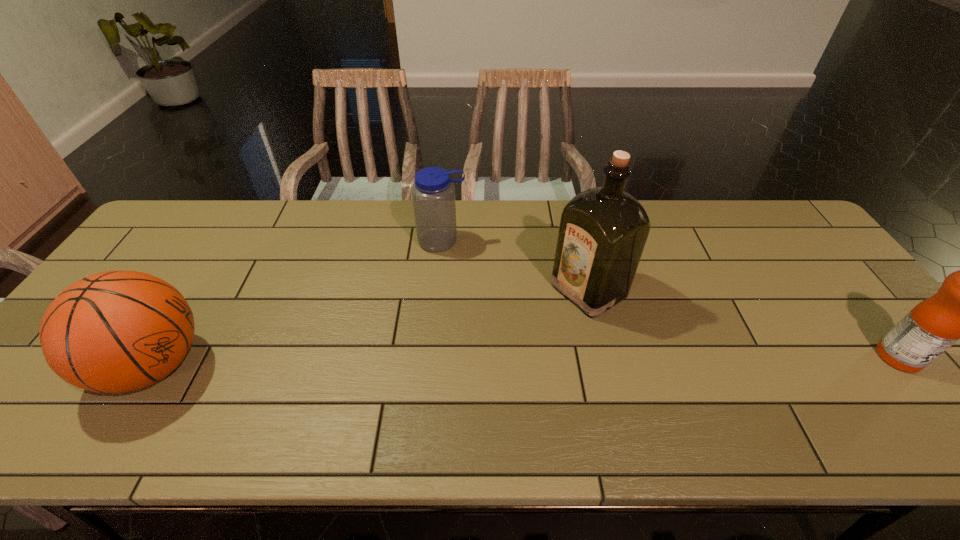
The image size is (960, 540). In the image, there is a desktop. What are the coordinates of `vacant space at the far edge` in the screenshot? It's located at (544, 208).

You are a GUI agent. You are given a task and a screenshot of the screen. Output one action in this format:
    pyautogui.click(x=<x>, y=<y>)
    Task: Click on the free space at the near edge of the desktop
    
    Given the screenshot: What is the action you would take?
    pyautogui.click(x=391, y=378)

At what (x,y) coordinates should I click in order to perform the action: click on vacant area at the right edge of the desktop. Please return your answer as a coordinate pair (x, y). The height and width of the screenshot is (540, 960). Looking at the image, I should click on (780, 249).

You are a GUI agent. You are given a task and a screenshot of the screen. Output one action in this format:
    pyautogui.click(x=<x>, y=<y>)
    Task: Click on the vacant position at the far left corner of the desktop
    This screenshot has height=540, width=960.
    Given the screenshot: What is the action you would take?
    pyautogui.click(x=197, y=228)

In the image, there is a desktop. Where is `vacant space at the near right corner`? vacant space at the near right corner is located at coordinates pyautogui.click(x=920, y=401).

You are a GUI agent. You are given a task and a screenshot of the screen. Output one action in this format:
    pyautogui.click(x=<x>, y=<y>)
    Task: Click on the free space that is in between the fruit juice and the farthest object
    
    Given the screenshot: What is the action you would take?
    pyautogui.click(x=670, y=299)

Where is `free space between the rightmost object and the tallest object`? free space between the rightmost object and the tallest object is located at coordinates click(x=743, y=323).

The height and width of the screenshot is (540, 960). What are the coordinates of `unoccupied position between the farthest object and the fruit juice` in the screenshot? It's located at (670, 299).

In order to click on vacant point located between the liquor and the fruit juice in this screenshot , I will do `click(743, 323)`.

Identify the location of vacant point located between the water bottle and the tallest object. This screenshot has height=540, width=960. (516, 266).